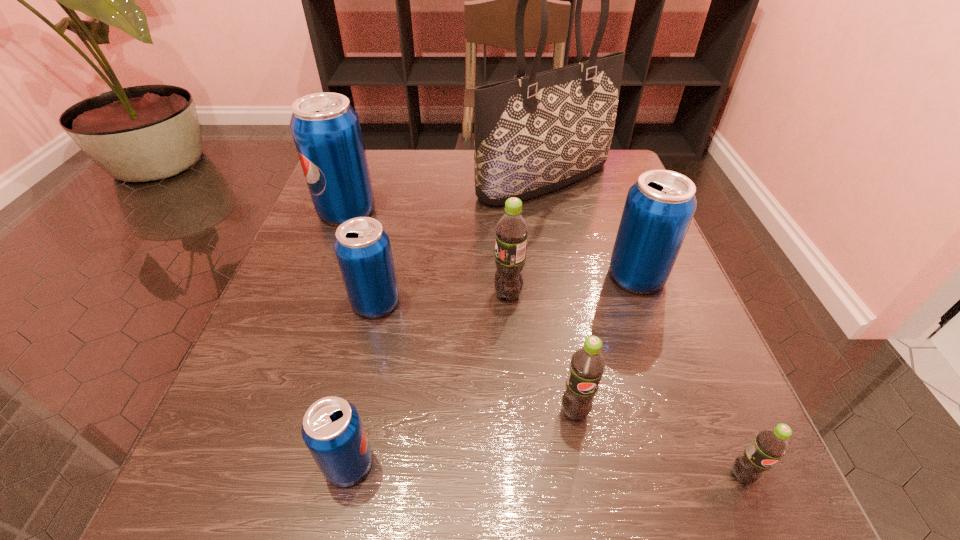
What are the coordinates of `the nearest blue pop soda` in the screenshot? It's located at [x=332, y=430].

Where is `the smallest green soda`? This screenshot has width=960, height=540. the smallest green soda is located at coordinates (769, 445).

Where is `the nearest green soda`? This screenshot has height=540, width=960. the nearest green soda is located at coordinates (769, 445).

Find the location of a particular element. Image resolution: width=960 pixels, height=540 pixels. vacant area located on the left of the tallest object is located at coordinates (355, 180).

Find the location of a particular element. This screenshot has height=540, width=960. vacant space situated on the front of the biggest blue pop soda is located at coordinates (275, 406).

Where is `vacant point located on the left of the rightmost blue pop soda`? Image resolution: width=960 pixels, height=540 pixels. vacant point located on the left of the rightmost blue pop soda is located at coordinates (575, 276).

At what (x,y) coordinates should I click in order to perform the action: click on free space located on the front label of the biggest green soda. Please return your answer as a coordinate pair (x, y). This screenshot has width=960, height=540. Looking at the image, I should click on (429, 294).

Image resolution: width=960 pixels, height=540 pixels. Find the location of `vacant space located 0.250m on the front label of the biggest green soda`. vacant space located 0.250m on the front label of the biggest green soda is located at coordinates (348, 294).

This screenshot has width=960, height=540. Find the location of `blank space located on the front label of the biggest green soda`. blank space located on the front label of the biggest green soda is located at coordinates (348, 294).

I want to click on vacant space located on the back of the second smallest blue pop soda, so click(405, 175).